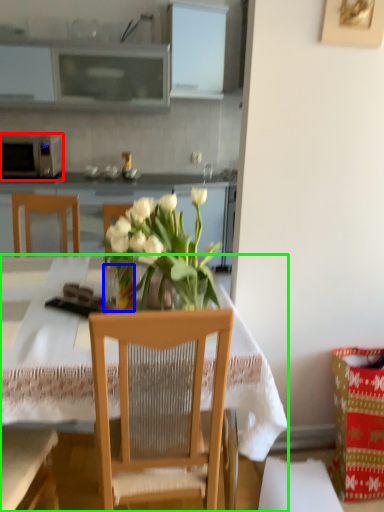
Question: Which object is the closest to the microwave oven (highlighted by a red box)? Choose among these: vase (highlighted by a blue box) or desk (highlighted by a green box).

Choices:
 (A) vase
 (B) desk

Answer: (B)